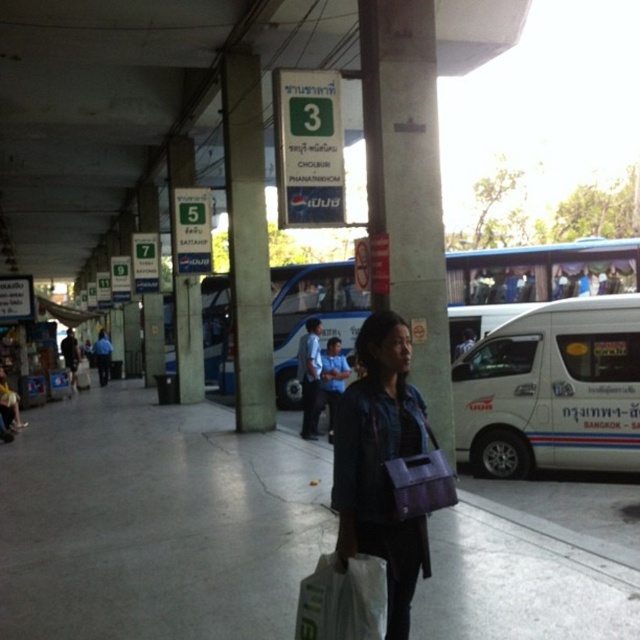
Question: Which point is farther to the camera?

Choices:
 (A) dark blue jeans at left
 (B) blue metallic bus at center

Answer: (A)

Question: Which of these objects is positioned farthest from the white matte van at center?

Choices:
 (A) dark blue uniform at center
 (B) dark blue jeans at left

Answer: (B)

Question: Where is gray concrete pavement at center located in relation to blue shirt at center in the image?

Choices:
 (A) left
 (B) right

Answer: (A)

Question: Does white matte van at center appear on the left side of dark blue jeans at left?

Choices:
 (A) yes
 (B) no

Answer: (B)

Question: Among these points, which one is farthest from the camera?

Choices:
 (A) (349, 582)
 (B) (70, 376)
 (C) (10, 401)

Answer: (B)

Question: Is gray concrete pavement at center to the left of yellow fabric shirt at lower left from the viewer's perspective?

Choices:
 (A) yes
 (B) no

Answer: (B)